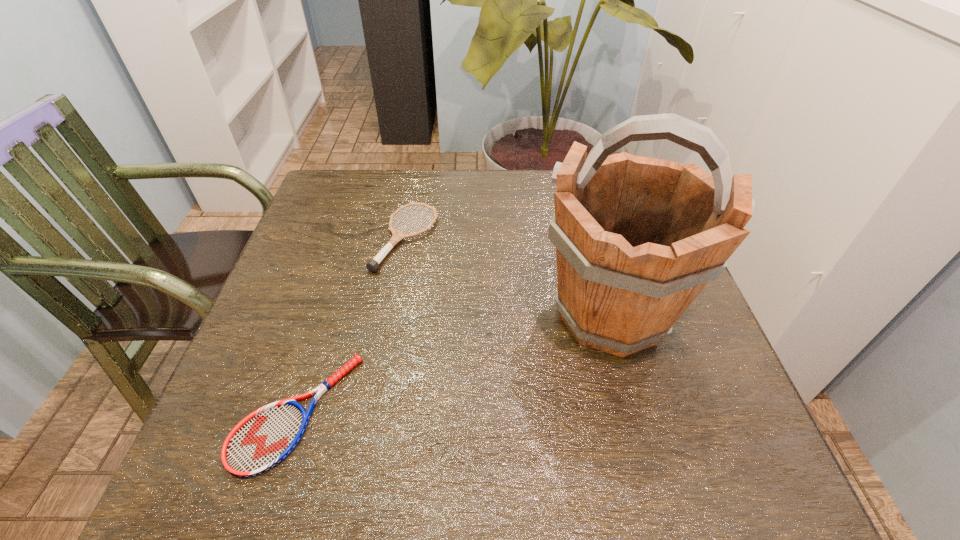
Find the location of a particular element. bucket is located at coordinates (637, 239).

Identify the location of the tallest object. The image size is (960, 540). (637, 239).

This screenshot has width=960, height=540. I want to click on the second shortest object, so click(372, 265).

Identify the location of the farther tennis racket. (372, 265).

At what (x,y) coordinates should I click in order to perform the action: click on the nearer tennis racket. Please return your answer as a coordinate pair (x, y). Looking at the image, I should click on (263, 439).

Find the location of a particular element. the shortest object is located at coordinates (263, 439).

Find the location of a particular element. vacant space located 0.230m on the left of the tallest object is located at coordinates (427, 314).

Find the location of a particular element. free spot located on the back of the taller tennis racket is located at coordinates (419, 170).

I want to click on free space located on the right of the shortest object, so tap(463, 412).

Locate an element on the screen. The height and width of the screenshot is (540, 960). object that is at the far edge is located at coordinates (372, 265).